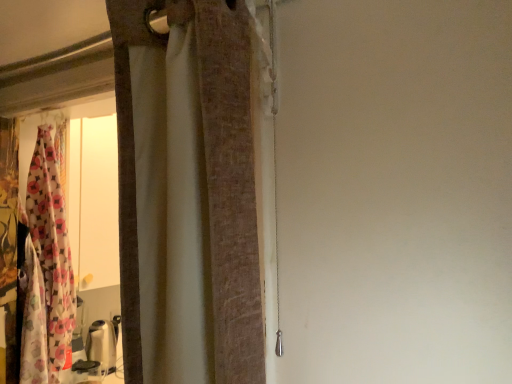
Question: From a real-world perspective, is textured beige curtain at center, acting as the 2th curtain starting from the left, physically located above or below floral fabric curtain at left, the second curtain in the right-to-left sequence?

Choices:
 (A) below
 (B) above

Answer: (B)

Question: In the image, is textured beige curtain at center, which is the first curtain from right to left, on the left side or the right side of floral fabric curtain at left, the 2th curtain in the front-to-back sequence?

Choices:
 (A) right
 (B) left

Answer: (A)

Question: Is textured beige curtain at center, acting as the 2th curtain starting from the left, spatially inside floral fabric curtain at left, the 2th curtain in the front-to-back sequence, or outside of it?

Choices:
 (A) inside
 (B) outside

Answer: (B)

Question: In the image, is floral fabric curtain at left, arranged as the first curtain when viewed from the back, on the left side or the right side of textured beige curtain at center, which is the first curtain from right to left?

Choices:
 (A) right
 (B) left

Answer: (B)

Question: Considering their positions, is floral fabric curtain at left, the 2th curtain in the front-to-back sequence, located in front of or behind textured beige curtain at center, which is counted as the first curtain, starting from the front?

Choices:
 (A) behind
 (B) front

Answer: (A)

Question: From a real-world perspective, relative to textured beige curtain at center, acting as the 2th curtain starting from the left, is floral fabric curtain at left, the 1th curtain viewed from the left, vertically above or below?

Choices:
 (A) below
 (B) above

Answer: (A)

Question: Which is correct: floral fabric curtain at left, the 1th curtain viewed from the left, is inside textured beige curtain at center, which is the first curtain from right to left, or outside of it?

Choices:
 (A) inside
 (B) outside

Answer: (B)